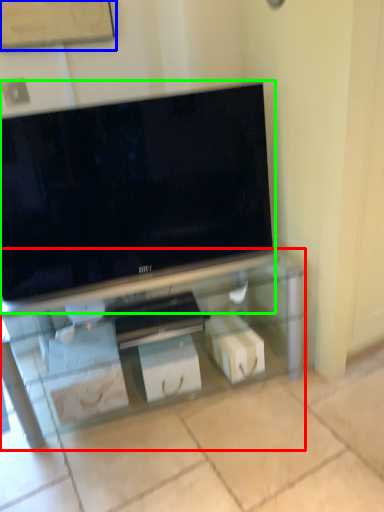
Question: Estimate the real-world distances between objects in this image. Which object is closer to furniture (highlighted by a red box), bulletin board (highlighted by a blue box) or television (highlighted by a green box)?

Choices:
 (A) bulletin board
 (B) television

Answer: (B)